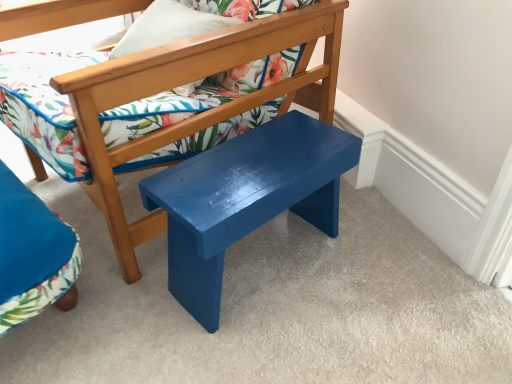
Identify the location of vacant area that is in front of glossy wood stool at center. (271, 341).